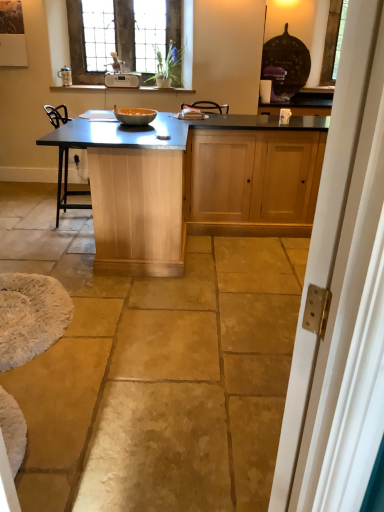
Question: Is white fluffy rug at lower left not near matte orange bowl at center?

Choices:
 (A) yes
 (B) no

Answer: (A)

Question: Is white fluffy rug at lower left bigger than matte orange bowl at center?

Choices:
 (A) yes
 (B) no

Answer: (A)

Question: Is the position of white fluffy rug at lower left less distant than that of matte orange bowl at center?

Choices:
 (A) yes
 (B) no

Answer: (A)

Question: From the image's perspective, would you say white fluffy rug at lower left is positioned over matte orange bowl at center?

Choices:
 (A) yes
 (B) no

Answer: (B)

Question: Can you confirm if white fluffy rug at lower left is taller than matte orange bowl at center?

Choices:
 (A) no
 (B) yes

Answer: (B)

Question: From a real-world perspective, is white fluffy rug at lower left positioned above or below white wood screen door at right?

Choices:
 (A) below
 (B) above

Answer: (A)

Question: Considering the relative positions of white fluffy rug at lower left and white wood screen door at right in the image provided, is white fluffy rug at lower left to the left or to the right of white wood screen door at right?

Choices:
 (A) left
 (B) right

Answer: (A)

Question: Is white fluffy rug at lower left inside the boundaries of white wood screen door at right, or outside?

Choices:
 (A) outside
 (B) inside

Answer: (A)

Question: Considering the positions of point (3, 281) and point (301, 300), is point (3, 281) closer or farther from the camera than point (301, 300)?

Choices:
 (A) closer
 (B) farther

Answer: (B)

Question: From a real-world perspective, relative to matte wood table at center, is matte orange bowl at center vertically above or below?

Choices:
 (A) below
 (B) above

Answer: (B)

Question: Would you say matte orange bowl at center is inside or outside matte wood table at center?

Choices:
 (A) inside
 (B) outside

Answer: (B)

Question: Is matte orange bowl at center wider or thinner than matte wood table at center?

Choices:
 (A) thin
 (B) wide

Answer: (A)

Question: Does point (150, 120) appear closer or farther from the camera than point (170, 161)?

Choices:
 (A) farther
 (B) closer

Answer: (A)

Question: In the image, is stained glass window at upper center positioned in front of or behind white plastic toaster at upper center?

Choices:
 (A) front
 (B) behind

Answer: (A)

Question: From the image's perspective, is stained glass window at upper center above or below white plastic toaster at upper center?

Choices:
 (A) below
 (B) above

Answer: (B)